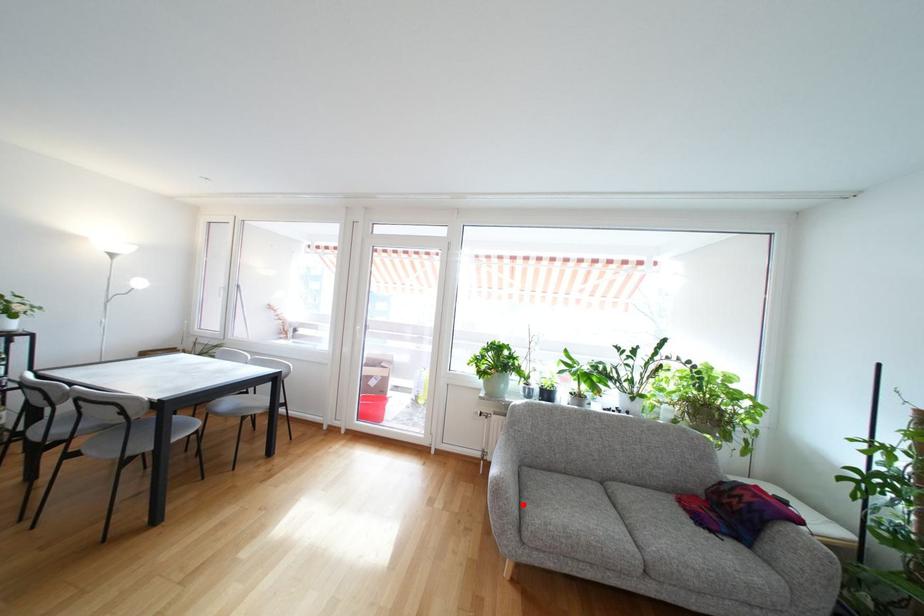
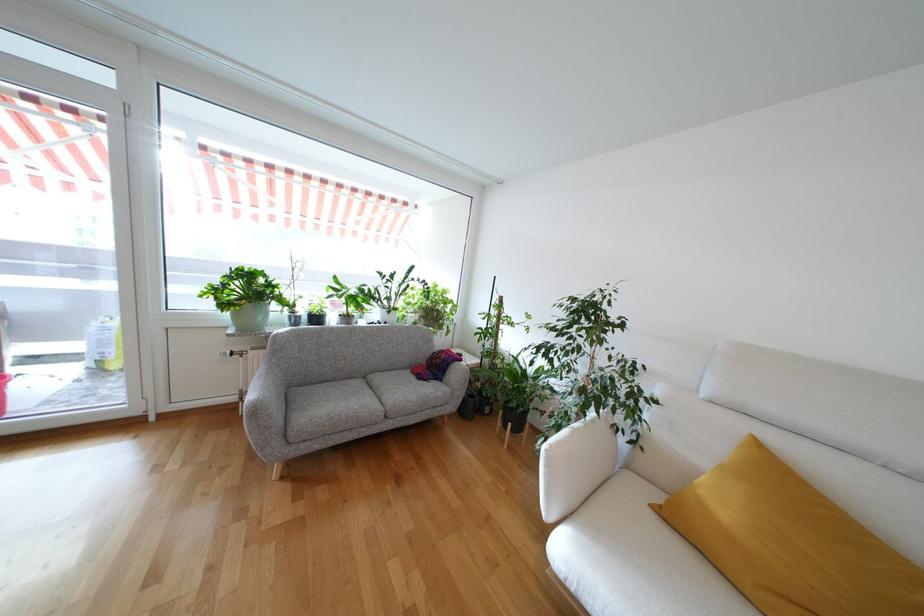
Where in the second image is the point corresponding to the highlighted location from the first image?

(290, 418)